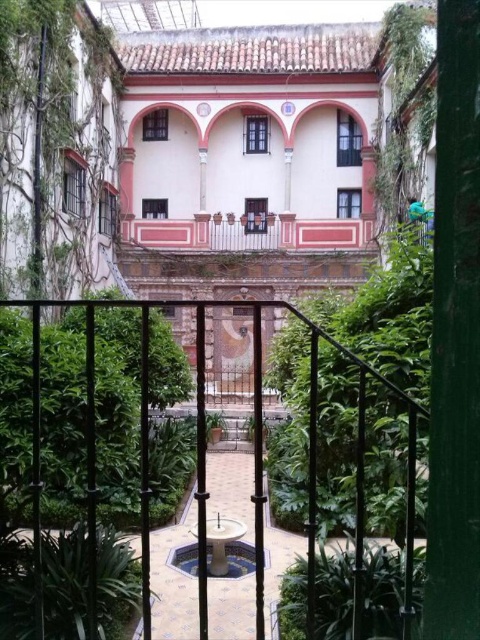
Question: Does black metal fence at center appear on the right side of green leafy plant at lower left?

Choices:
 (A) yes
 (B) no

Answer: (A)

Question: Among these points, which one is farthest from the camera?

Choices:
 (A) (137, 604)
 (B) (330, 564)
 (C) (205, 497)

Answer: (A)

Question: Can you confirm if black metal fence at center is positioned below green leafy plant at center?

Choices:
 (A) yes
 (B) no

Answer: (B)

Question: In this image, where is green leafy plant at lower left located relative to green leafy plant at center?

Choices:
 (A) above
 (B) below

Answer: (A)

Question: Which is farther from the green leafy plant at lower left?

Choices:
 (A) green leafy plant at center
 (B) black metal fence at center

Answer: (A)

Question: Which point is closer to the camera?

Choices:
 (A) green leafy plant at lower left
 (B) green leafy plant at center
 (C) black metal fence at center

Answer: (C)